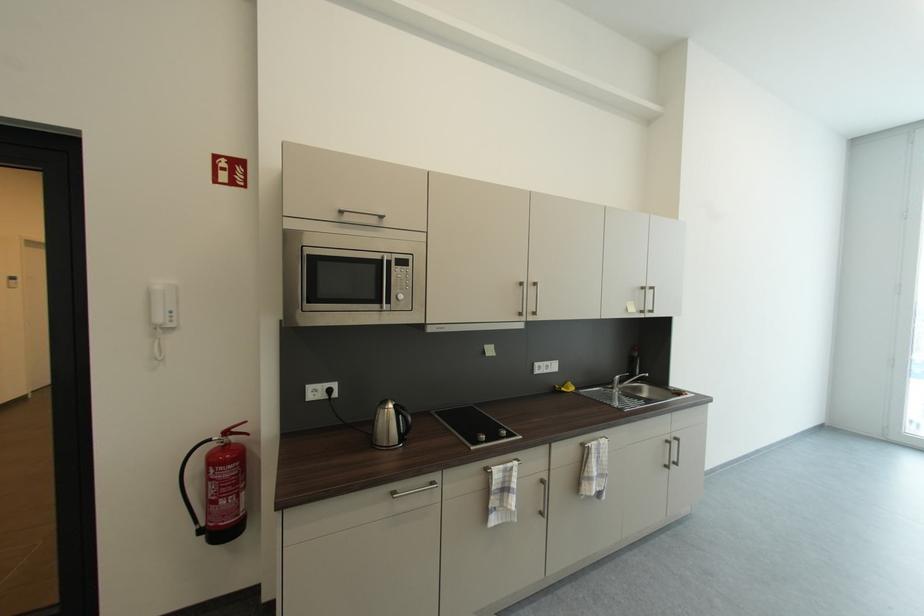
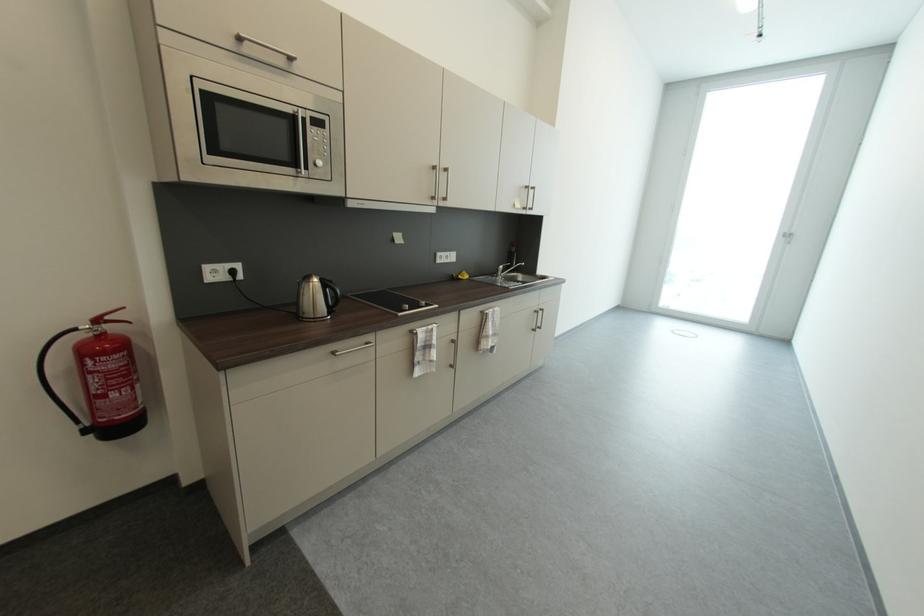
Question: The camera is either moving clockwise (left) or counter-clockwise (right) around the object. The first image is from the beginning of the video and the second image is from the end. Is the camera moving left or right when shooting the video?

Choices:
 (A) Left
 (B) Right

Answer: (A)